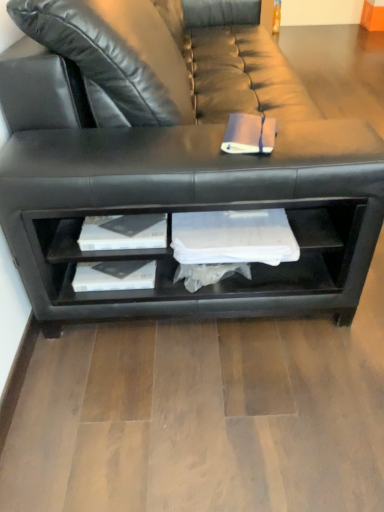
What is the approximate width of black leather couch at center?

black leather couch at center is 3.37 feet in width.

You are a GUI agent. You are given a task and a screenshot of the screen. Output one action in this format:
    pyautogui.click(x=<x>, y=<y>)
    Task: Click on the black leather couch at center
    This screenshot has height=512, width=384.
    Given the screenshot: What is the action you would take?
    pyautogui.click(x=174, y=159)

The width and height of the screenshot is (384, 512). Describe the element at coordinates (174, 159) in the screenshot. I see `black leather couch at center` at that location.

Measure the distance between black leather couch at center and camera.

The depth of black leather couch at center is 36.61 inches.

Describe the element at coordinates (249, 134) in the screenshot. I see `pink matte book at center` at that location.

This screenshot has width=384, height=512. I want to click on pink matte book at center, so click(249, 134).

Measure the distance between point [245,118] and camera.

Point [245,118] and camera are 3.57 feet apart.

Locate an element on the screen. black leather couch at center is located at coordinates (174, 159).

Considering the relative positions of pink matte book at center and black leather couch at center in the image provided, is pink matte book at center to the left of black leather couch at center from the viewer's perspective?

In fact, pink matte book at center is to the right of black leather couch at center.

Considering the relative positions of pink matte book at center and black leather couch at center in the image provided, is pink matte book at center behind black leather couch at center?

Yes, it is.

Based on the photo, which point is more forward, (256, 132) or (50, 298)?

The point (256, 132) is closer.

From the image's perspective, who appears lower, pink matte book at center or black leather couch at center?

pink matte book at center, from the image's perspective.

From a real-world perspective, is pink matte book at center on top of black leather couch at center?

Yes.

Is pink matte book at center wider than black leather couch at center?

No.

Does pink matte book at center have a greater height compared to black leather couch at center?

In fact, pink matte book at center may be shorter than black leather couch at center.

Considering the sizes of pink matte book at center and black leather couch at center in the image, is pink matte book at center bigger or smaller than black leather couch at center?

In the image, pink matte book at center appears to be smaller than black leather couch at center.

Can black leather couch at center be found inside pink matte book at center?

No, black leather couch at center is located outside of pink matte book at center.

Is pink matte book at center touching black leather couch at center?

No, pink matte book at center is not next to black leather couch at center.

Is pink matte book at center positioned with its back to black leather couch at center?

That's right, pink matte book at center is facing away from black leather couch at center.

Can you tell me how much pink matte book at center and black leather couch at center differ in facing direction?

They differ by 10.8 degrees in their facing directions.

How much distance is there between pink matte book at center and black leather couch at center?

A distance of 15.39 inches exists between pink matte book at center and black leather couch at center.

Where is `studio couch located above the pink matte book at center (from the image's perspective)`? Image resolution: width=384 pixels, height=512 pixels. studio couch located above the pink matte book at center (from the image's perspective) is located at coordinates (174, 159).

Is black leather couch at center to the left of pink matte book at center from the viewer's perspective?

Yes.

Between black leather couch at center and pink matte book at center, which one is positioned behind?

pink matte book at center is further from the camera.

Does point (351, 131) appear closer or farther from the camera than point (238, 145)?

Point (351, 131) appears to be farther away from the viewer than point (238, 145).

From the image's perspective, who appears lower, black leather couch at center or pink matte book at center?

pink matte book at center, from the image's perspective.

From a real-world perspective, is black leather couch at center positioned over pink matte book at center based on gravity?

Actually, black leather couch at center is physically below pink matte book at center in the real world.

Does black leather couch at center have a lesser width compared to pink matte book at center?

No.

Between black leather couch at center and pink matte book at center, which one has less height?

With less height is pink matte book at center.

Does black leather couch at center have a larger size compared to pink matte book at center?

Indeed, black leather couch at center has a larger size compared to pink matte book at center.

Is black leather couch at center surrounding pink matte book at center?

That's correct, pink matte book at center is inside black leather couch at center.

Is black leather couch at center with pink matte book at center?

black leather couch at center and pink matte book at center are not in contact.

Looking at this image, could you tell me if black leather couch at center is facing pink matte book at center?

No, black leather couch at center is not facing towards pink matte book at center.

How different are the orientations of black leather couch at center and pink matte book at center in degrees?

The angle between the facing direction of black leather couch at center and the facing direction of pink matte book at center is 10.8 degrees.

Measure the distance from black leather couch at center to pink matte book at center.

They are 15.39 inches apart.

Locate an element on the screen. book that is on the right side of black leather couch at center is located at coordinates (249, 134).

Locate an element on the screen. The image size is (384, 512). studio couch in front of the pink matte book at center is located at coordinates (174, 159).

What are the coordinates of `book above the black leather couch at center (from a real-world perspective)` in the screenshot? It's located at (249, 134).